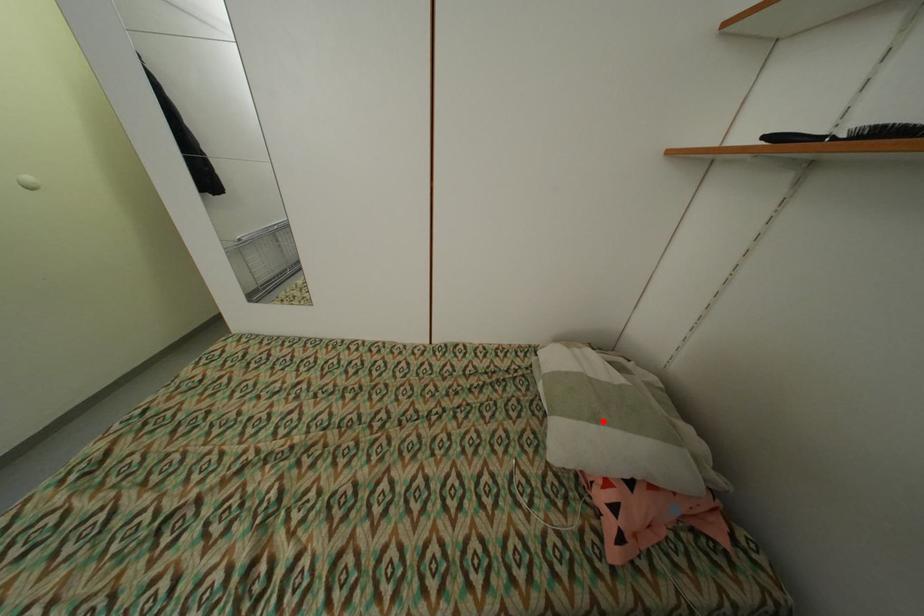
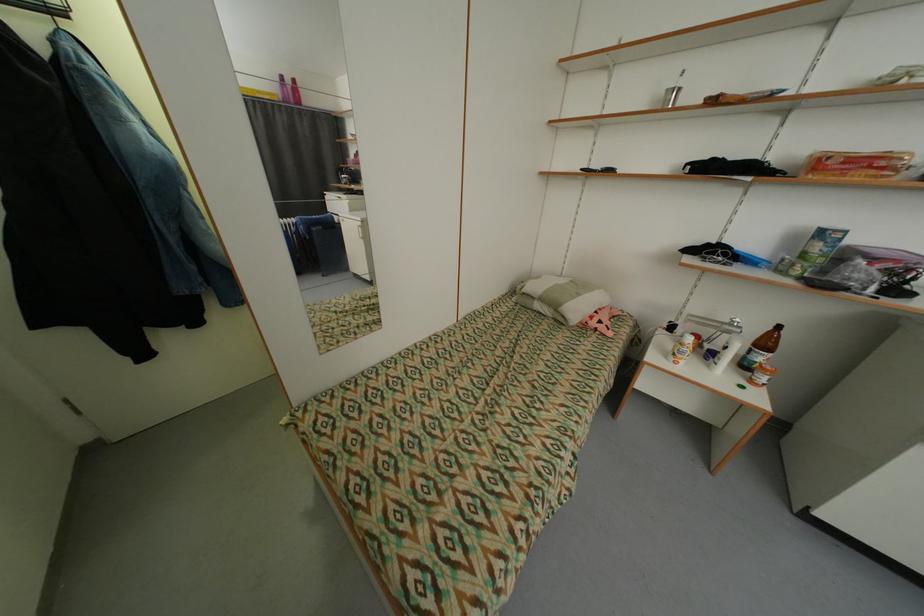
In the second image, find the point that corresponds to the highlighted location in the first image.

(585, 296)